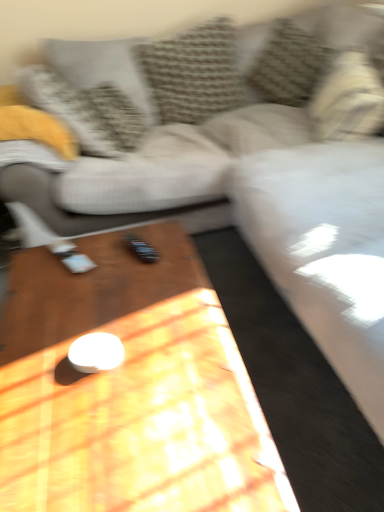
Measure the distance between point (360, 112) and camera.

A distance of 6.11 feet exists between point (360, 112) and camera.

Identify the location of wooden coffee table at center. (130, 391).

The height and width of the screenshot is (512, 384). I want to click on textured gray pillow at upper left, the 4th pillow when ordered from right to left, so click(x=86, y=111).

This screenshot has width=384, height=512. I want to click on beige textured pillow at upper right, acting as the 5th pillow starting from the left, so click(347, 100).

Between textured gray pillow at upper left, the 4th pillow when ordered from right to left, and textured gray pillow at upper center, which is the 4th pillow in left-to-right order, which one appears on the right side from the viewer's perspective?

textured gray pillow at upper center, which is the 4th pillow in left-to-right order.

Does textured gray pillow at upper left, positioned as the second pillow in left-to-right order, come behind textured gray pillow at upper center, which is the 4th pillow in left-to-right order?

No, it is in front of textured gray pillow at upper center, which is the 4th pillow in left-to-right order.

Does textured gray pillow at upper left, the 4th pillow when ordered from right to left, have a lesser height compared to textured gray pillow at upper center, the 2th pillow in the right-to-left sequence?

Yes, textured gray pillow at upper left, the 4th pillow when ordered from right to left, is shorter than textured gray pillow at upper center, the 2th pillow in the right-to-left sequence.

Are textured gray pillow at upper left, positioned as the second pillow in left-to-right order, and textured gray pillow at upper center, which is the 4th pillow in left-to-right order, far apart?

textured gray pillow at upper left, positioned as the second pillow in left-to-right order, is actually quite close to textured gray pillow at upper center, which is the 4th pillow in left-to-right order.

Which of these two, wooden coffee table at center or textured gray pillow at upper left, positioned as the second pillow in left-to-right order, is thinner?

Thinner between the two is textured gray pillow at upper left, positioned as the second pillow in left-to-right order.

Would you consider wooden coffee table at center to be distant from textured gray pillow at upper left, the 4th pillow when ordered from right to left?

That's right, there is a large distance between wooden coffee table at center and textured gray pillow at upper left, the 4th pillow when ordered from right to left.

From a real-world perspective, is wooden coffee table at center under textured gray pillow at upper left, positioned as the second pillow in left-to-right order?

Yes.

Is beige textured pillow at upper right, acting as the 5th pillow starting from the left, not inside wooden coffee table at center?

Yes, beige textured pillow at upper right, acting as the 5th pillow starting from the left, is located beyond the bounds of wooden coffee table at center.

Which of these two, beige textured pillow at upper right, acting as the 5th pillow starting from the left, or wooden coffee table at center, stands shorter?

Standing shorter between the two is wooden coffee table at center.

Which is in front, point (375, 113) or point (209, 328)?

Positioned in front is point (209, 328).

Is beige textured pillow at upper right, which is counted as the first pillow, starting from the right, thinner than wooden coffee table at center?

Yes.

You are a GUI agent. You are given a task and a screenshot of the screen. Output one action in this format:
    pyautogui.click(x=<x>, y=<y>)
    Task: Click on the 3rd pillow below the textured gray pillow at upper left, placed as the 1th pillow when sorted from left to right (from a real-world perspective)
    
    Given the screenshot: What is the action you would take?
    pyautogui.click(x=347, y=100)

From the image's perspective, is textured gray pillow at upper left, the 5th pillow when ordered from right to left, below beige textured pillow at upper right, which is counted as the first pillow, starting from the right?

No, from the image's perspective, textured gray pillow at upper left, the 5th pillow when ordered from right to left, is not beneath beige textured pillow at upper right, which is counted as the first pillow, starting from the right.

Is textured gray pillow at upper left, placed as the 1th pillow when sorted from left to right, bigger or smaller than beige textured pillow at upper right, acting as the 5th pillow starting from the left?

Clearly, textured gray pillow at upper left, placed as the 1th pillow when sorted from left to right, is smaller in size than beige textured pillow at upper right, acting as the 5th pillow starting from the left.

Locate an element on the screen. This screenshot has height=512, width=384. the 2nd pillow counting from the right of the wooden coffee table at center is located at coordinates (289, 64).

Does point (59, 268) appear closer or farther from the camera than point (292, 50)?

Point (59, 268) is closer to the camera than point (292, 50).

Is wooden coffee table at center shorter than textured gray pillow at upper center, the 2th pillow in the right-to-left sequence?

Yes.

Is the position of wooden coffee table at center less distant than that of textured gray pillow at upper center, which is the 4th pillow in left-to-right order?

Yes, it is.

Where is `pillow that is the 4th object located above the wooden coffee table at center (from the image's perspective)`? pillow that is the 4th object located above the wooden coffee table at center (from the image's perspective) is located at coordinates (194, 73).

Which of these two, textured beige pillow at upper center, the 3th pillow in the right-to-left sequence, or wooden coffee table at center, is wider?

With larger width is wooden coffee table at center.

Does point (201, 59) lie in front of point (223, 381)?

No, it is not.

Can you confirm if textured beige pillow at upper center, which ranks as the third pillow in left-to-right order, is bigger than wooden coffee table at center?

Incorrect, textured beige pillow at upper center, which ranks as the third pillow in left-to-right order, is not larger than wooden coffee table at center.

Is textured gray pillow at upper left, the 5th pillow when ordered from right to left, looking in the opposite direction of textured gray pillow at upper center, the 2th pillow in the right-to-left sequence?

No, textured gray pillow at upper left, the 5th pillow when ordered from right to left, is not facing away from textured gray pillow at upper center, the 2th pillow in the right-to-left sequence.

I want to click on the 3rd pillow to the left of the textured gray pillow at upper center, which is the 4th pillow in left-to-right order, counting from the anchor's position, so click(103, 68).

Is textured gray pillow at upper left, the 5th pillow when ordered from right to left, situated inside textured gray pillow at upper center, the 2th pillow in the right-to-left sequence, or outside?

textured gray pillow at upper left, the 5th pillow when ordered from right to left, exists outside the volume of textured gray pillow at upper center, the 2th pillow in the right-to-left sequence.

The height and width of the screenshot is (512, 384). I want to click on pillow that is the 1st one when counting forward from the textured gray pillow at upper center, the 2th pillow in the right-to-left sequence, so click(x=86, y=111).

At what (x,y) coordinates should I click in order to perform the action: click on coffee table that appears below the textured gray pillow at upper left, positioned as the second pillow in left-to-right order (from a real-world perspective). Please return your answer as a coordinate pair (x, y). Looking at the image, I should click on (130, 391).

Based on their spatial positions, is textured gray pillow at upper center, which is the 4th pillow in left-to-right order, or textured beige pillow at upper center, which ranks as the third pillow in left-to-right order, further from textured gray pillow at upper left, the 4th pillow when ordered from right to left?

textured gray pillow at upper center, which is the 4th pillow in left-to-right order, lies further to textured gray pillow at upper left, the 4th pillow when ordered from right to left, than the other object.

Based on the photo, which object lies nearer to the anchor point textured beige pillow at upper center, which ranks as the third pillow in left-to-right order, wooden coffee table at center or textured gray pillow at upper left, the 5th pillow when ordered from right to left?

textured gray pillow at upper left, the 5th pillow when ordered from right to left.

Considering their positions, is textured gray pillow at upper center, which is the 4th pillow in left-to-right order, positioned closer to beige textured pillow at upper right, which is counted as the first pillow, starting from the right, than textured gray pillow at upper left, positioned as the second pillow in left-to-right order?

textured gray pillow at upper center, which is the 4th pillow in left-to-right order, is closer to beige textured pillow at upper right, which is counted as the first pillow, starting from the right.

Looking at the image, which one is located further to wooden coffee table at center, beige textured pillow at upper right, acting as the 5th pillow starting from the left, or textured beige pillow at upper center, the 3th pillow in the right-to-left sequence?

textured beige pillow at upper center, the 3th pillow in the right-to-left sequence, lies further to wooden coffee table at center than the other object.

Considering their positions, is textured gray pillow at upper left, positioned as the second pillow in left-to-right order, positioned further to beige textured pillow at upper right, acting as the 5th pillow starting from the left, than wooden coffee table at center?

Based on the image, wooden coffee table at center appears to be further to beige textured pillow at upper right, acting as the 5th pillow starting from the left.

From the image, which object appears to be nearer to textured gray pillow at upper center, which is the 4th pillow in left-to-right order, textured gray pillow at upper left, the 4th pillow when ordered from right to left, or textured beige pillow at upper center, the 3th pillow in the right-to-left sequence?

textured beige pillow at upper center, the 3th pillow in the right-to-left sequence, is positioned closer to the anchor textured gray pillow at upper center, which is the 4th pillow in left-to-right order.

From the image, which object appears to be nearer to textured beige pillow at upper center, which ranks as the third pillow in left-to-right order, textured gray pillow at upper center, which is the 4th pillow in left-to-right order, or wooden coffee table at center?

textured gray pillow at upper center, which is the 4th pillow in left-to-right order, is positioned closer to the anchor textured beige pillow at upper center, which ranks as the third pillow in left-to-right order.

When comparing their distances from textured gray pillow at upper left, placed as the 1th pillow when sorted from left to right, does beige textured pillow at upper right, acting as the 5th pillow starting from the left, or textured gray pillow at upper left, positioned as the second pillow in left-to-right order, seem closer?

textured gray pillow at upper left, positioned as the second pillow in left-to-right order, is positioned closer to the anchor textured gray pillow at upper left, placed as the 1th pillow when sorted from left to right.

Where is `pillow between textured gray pillow at upper left, placed as the 1th pillow when sorted from left to right, and textured beige pillow at upper center, the 3th pillow in the right-to-left sequence, from left to right`? pillow between textured gray pillow at upper left, placed as the 1th pillow when sorted from left to right, and textured beige pillow at upper center, the 3th pillow in the right-to-left sequence, from left to right is located at coordinates (86, 111).

What are the coordinates of `pillow between wooden coffee table at center and textured gray pillow at upper left, positioned as the second pillow in left-to-right order, from front to back` in the screenshot? It's located at (347, 100).

Find the location of a particular element. pillow between textured beige pillow at upper center, which ranks as the third pillow in left-to-right order, and beige textured pillow at upper right, which is counted as the first pillow, starting from the right is located at coordinates (289, 64).

Find the location of `pillow located between textured gray pillow at upper left, positioned as the second pillow in left-to-right order, and textured gray pillow at upper center, which is the 4th pillow in left-to-right order, in the left-right direction`. pillow located between textured gray pillow at upper left, positioned as the second pillow in left-to-right order, and textured gray pillow at upper center, which is the 4th pillow in left-to-right order, in the left-right direction is located at coordinates (194, 73).